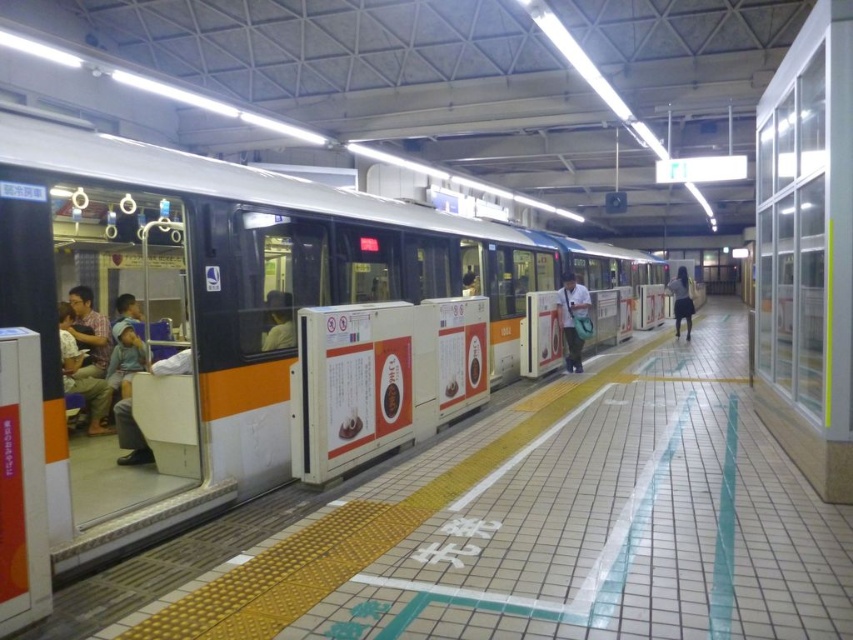
You are standing at point (x=65, y=353) on the subway platform. The train is 6.42 meters away from you. Can you safely walk to the train without crossing the tactile paving strips?

The train is 6.42 meters away from point (x=65, y=353). Since the tactile paving strips are near the edge of the platform, you can walk towards the train while keeping a safe distance from the edge to avoid stepping onto the tactile strips. However, ensure you do not get too close to the edge to stay safe.

You are a person standing on the subway platform and see the matte orange seat at left and the matte black shirt at left. Which object is bigger?

The matte orange seat at left is larger in size than the matte black shirt at left.